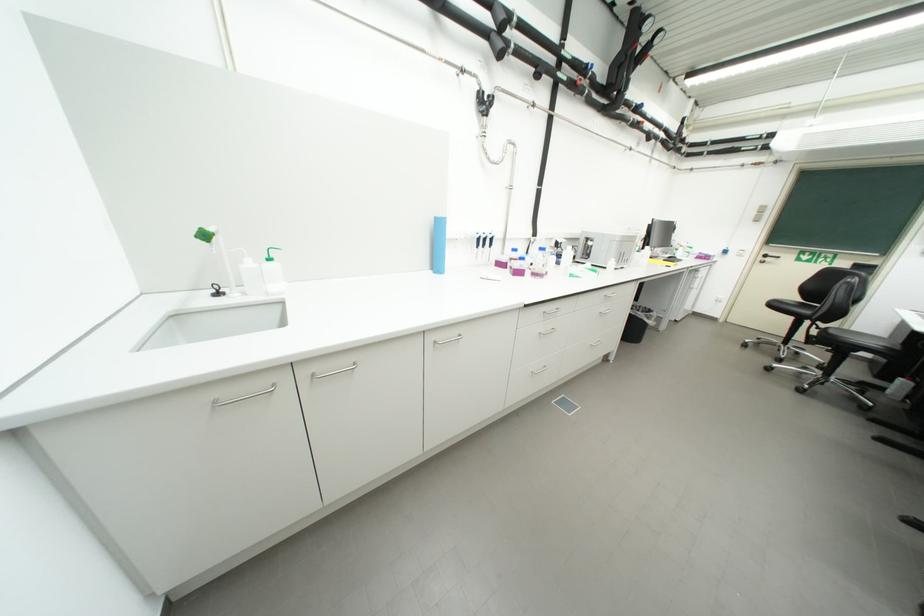
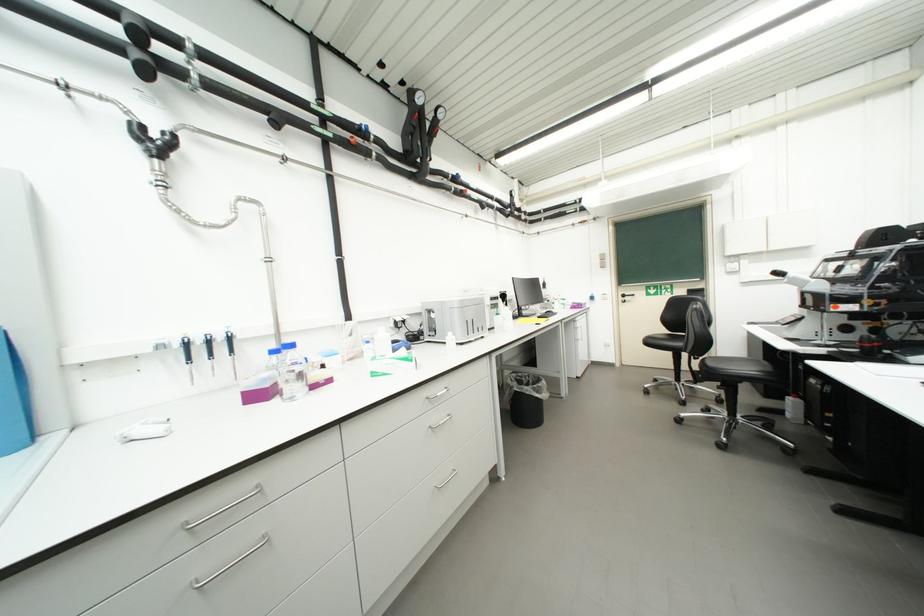
Which direction would the cameraman need to move to produce the second image?

The cameraman walked toward right, forward.